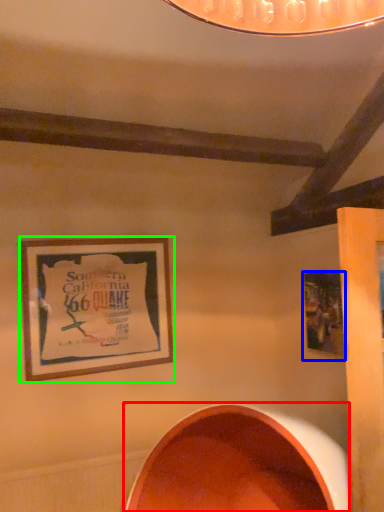
Question: Based on their relative distances, which object is farther from oval (highlighted by a red box)? Choose from picture frame (highlighted by a blue box) and picture frame (highlighted by a green box).

Choices:
 (A) picture frame
 (B) picture frame

Answer: (B)